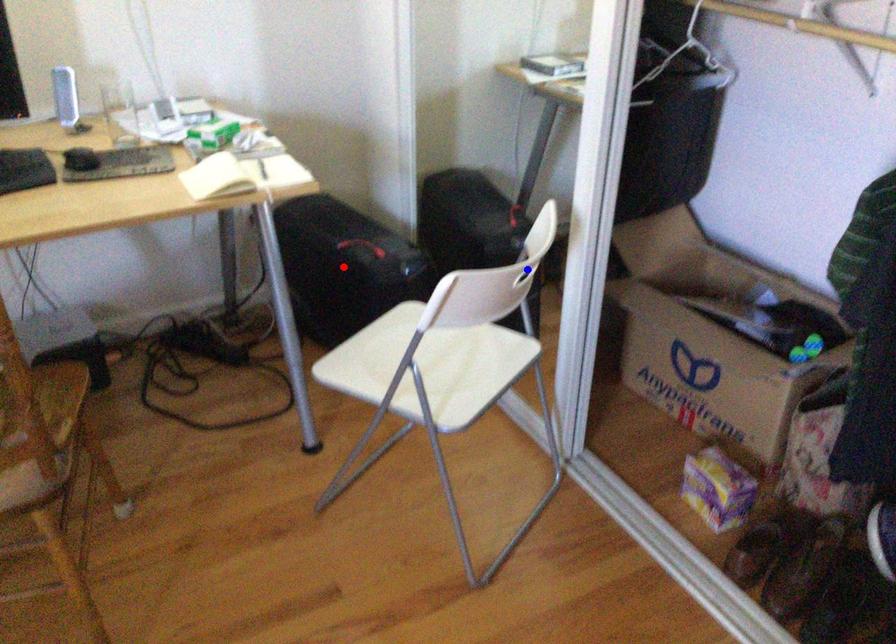
Question: Two points are marked on the image. Which point is closer to the camera?

Choices:
 (A) Blue point is closer.
 (B) Red point is closer.

Answer: (A)